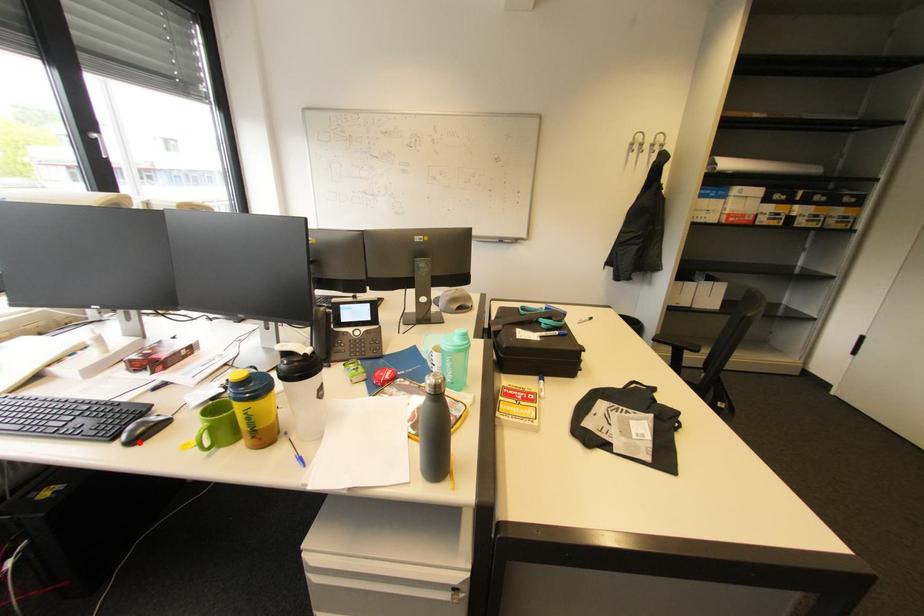
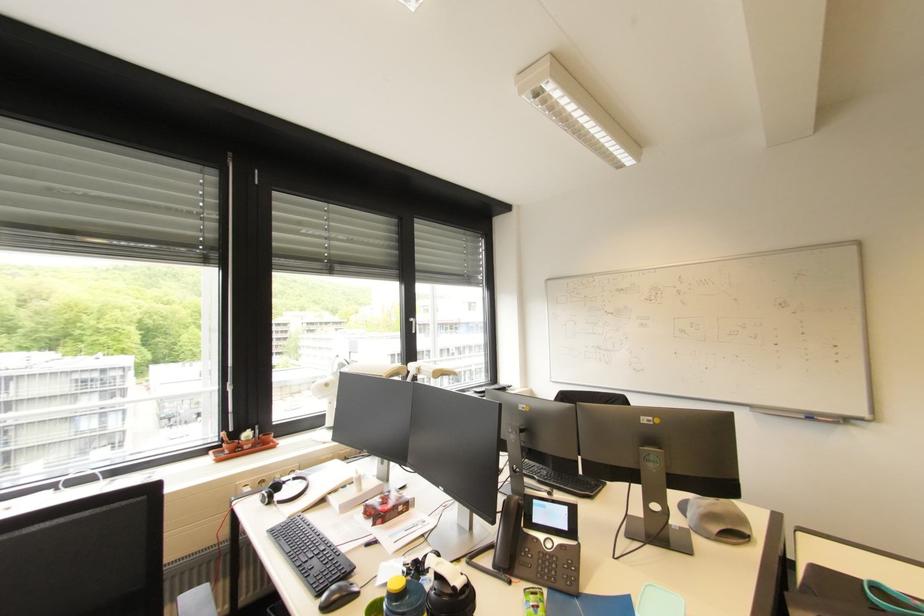
Find the pixel in the second image that matches the highlighted location in the first image.

(332, 609)